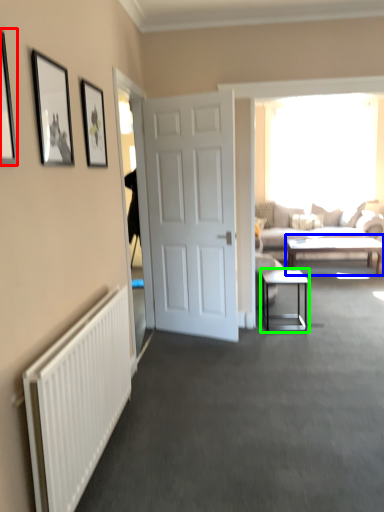
Question: Which object is positioned closest to picture frame (highlighted by a red box)? Select from coffee table (highlighted by a blue box) and table (highlighted by a green box).

Choices:
 (A) coffee table
 (B) table

Answer: (B)